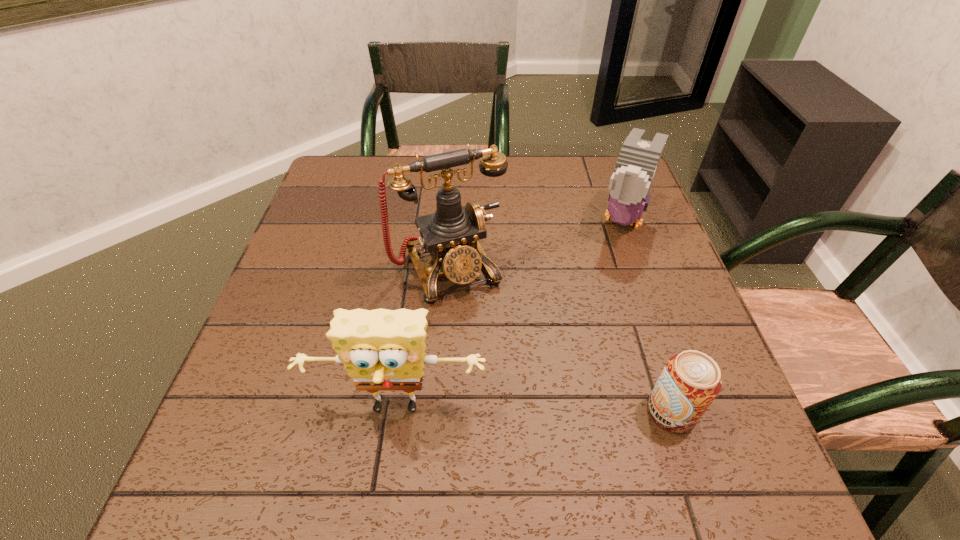
This screenshot has height=540, width=960. Find the location of `vacant point that satisfies the following two spatial constraints: 1. on the face of the beer can; 2. on the left side of the sponge`. vacant point that satisfies the following two spatial constraints: 1. on the face of the beer can; 2. on the left side of the sponge is located at coordinates (396, 411).

Where is `vacant area in the image that satisfies the following two spatial constraints: 1. on the face of the shortest object; 2. on the right side of the sponge`? Image resolution: width=960 pixels, height=540 pixels. vacant area in the image that satisfies the following two spatial constraints: 1. on the face of the shortest object; 2. on the right side of the sponge is located at coordinates (396, 411).

Image resolution: width=960 pixels, height=540 pixels. In order to click on free point that satisfies the following two spatial constraints: 1. on the face of the sponge; 2. on the left side of the beer can in this screenshot , I will do `click(396, 411)`.